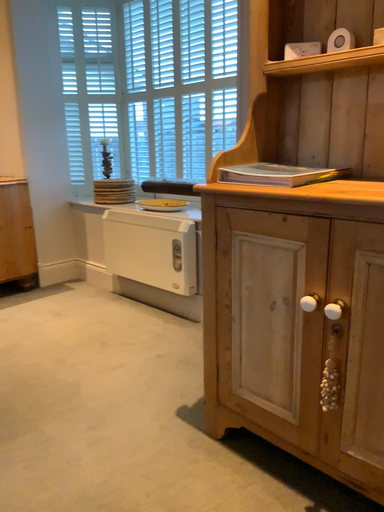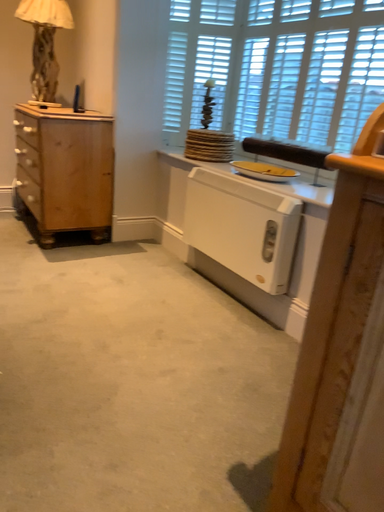
Question: How did the camera likely rotate when shooting the video?

Choices:
 (A) rotated left
 (B) rotated right

Answer: (A)